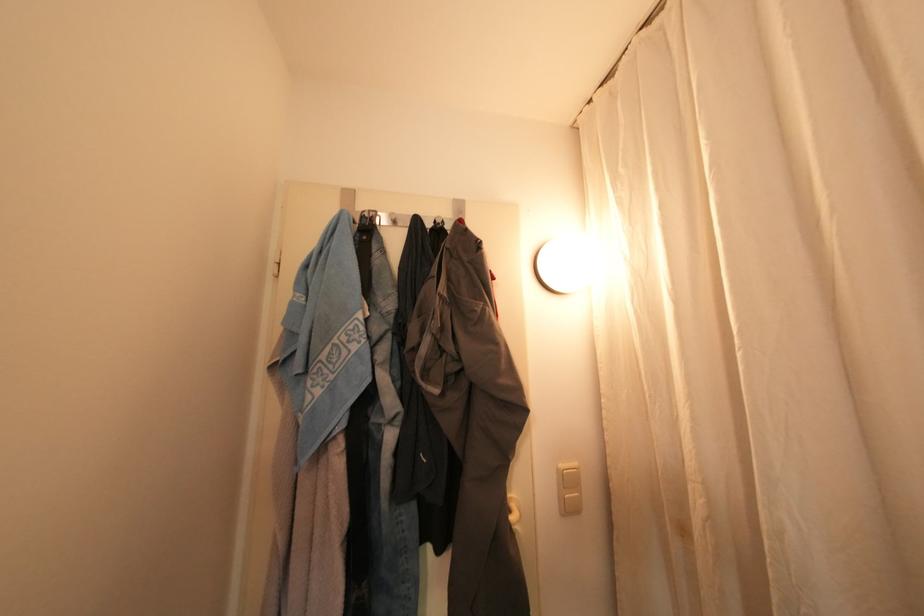
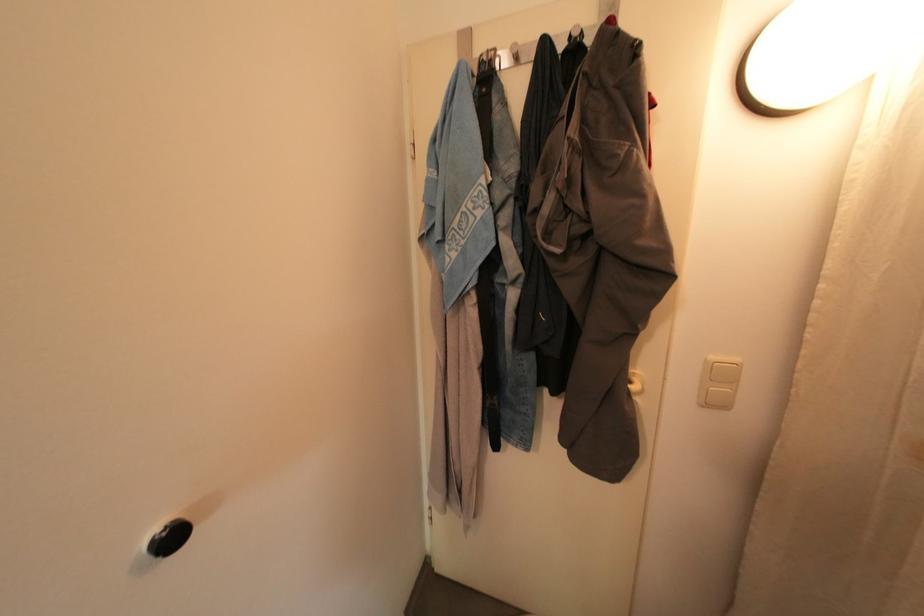
The images are taken continuously from a first-person perspective. In which direction is your viewpoint rotating?

The rotation direction of the camera is left-down.